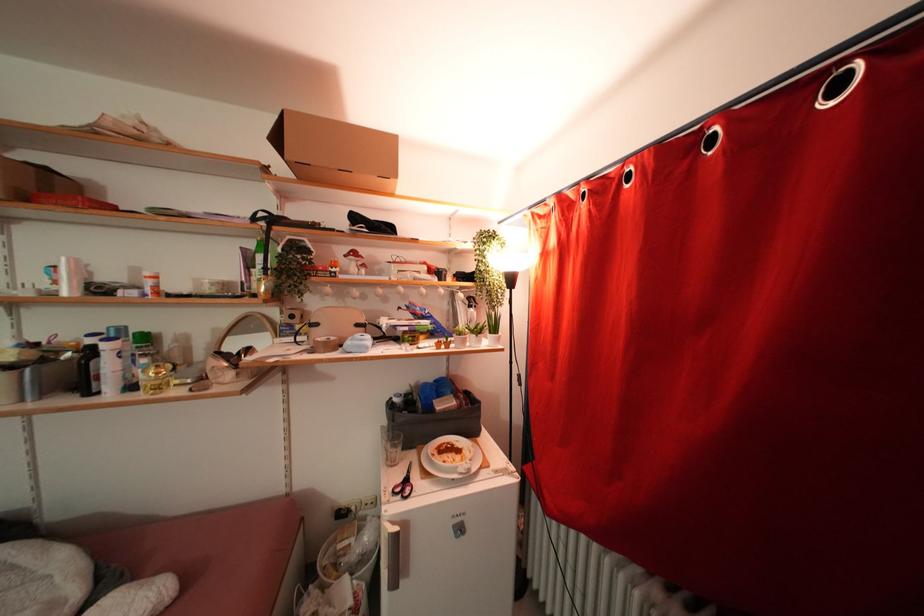
What do you see at coordinates (151, 548) in the screenshot? I see `a sofa sitting surface` at bounding box center [151, 548].